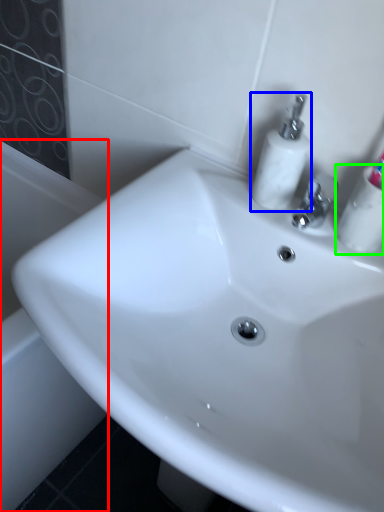
Question: Which object is the farthest from bath (highlighted by a red box)? Choose among these: soap dispenser (highlighted by a blue box) or mouthwash (highlighted by a green box).

Choices:
 (A) soap dispenser
 (B) mouthwash

Answer: (B)